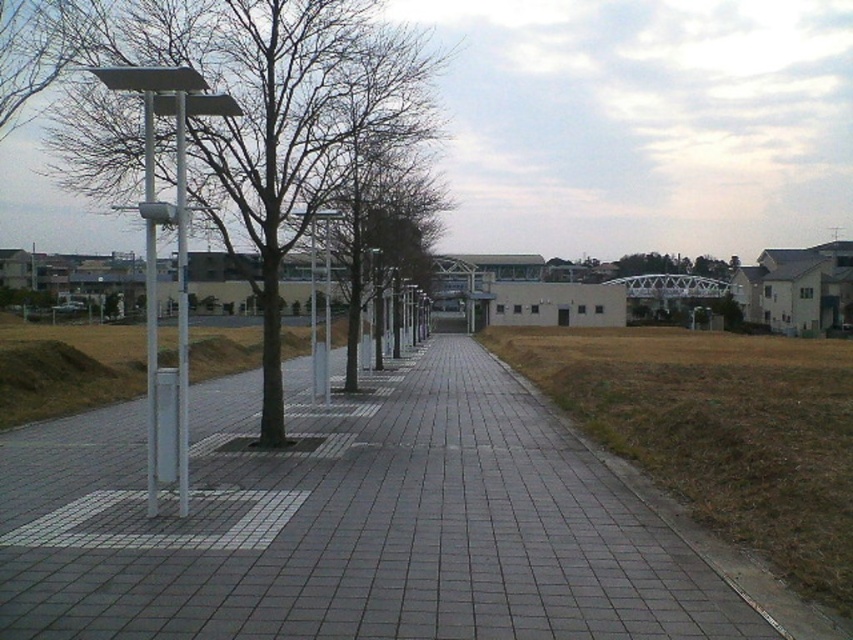
Which is more to the left, gray concrete pavement at center or metallic silver pole at left?

From the viewer's perspective, metallic silver pole at left appears more on the left side.

Between gray concrete pavement at center and metallic silver pole at left, which one appears on the right side from the viewer's perspective?

From the viewer's perspective, gray concrete pavement at center appears more on the right side.

Which is behind, point (521, 618) or point (148, 468)?

Positioned behind is point (148, 468).

Locate an element on the screen. This screenshot has width=853, height=640. gray concrete pavement at center is located at coordinates (355, 531).

Describe the element at coordinates (181, 305) in the screenshot. I see `metallic pole at left` at that location.

The width and height of the screenshot is (853, 640). What are the coordinates of `metallic pole at left` in the screenshot? It's located at pos(181,305).

Who is more forward, (178, 474) or (152, 291)?

Point (152, 291)

Where is `metallic pole at left`? The height and width of the screenshot is (640, 853). metallic pole at left is located at coordinates (181, 305).

Who is more distant from viewer, (302, 184) or (148, 304)?

The point (302, 184) is behind.

Is point (231, 84) behind point (154, 264)?

That is True.

I want to click on smooth gray tree at center, so click(x=271, y=113).